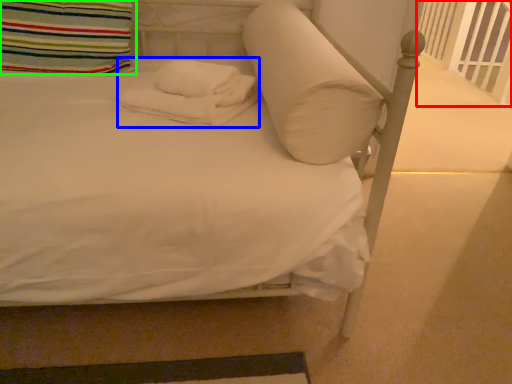
Question: Which is farther away from balustrade (highlighted by a red box)? material (highlighted by a blue box) or pillow (highlighted by a green box)?

Choices:
 (A) material
 (B) pillow

Answer: (B)